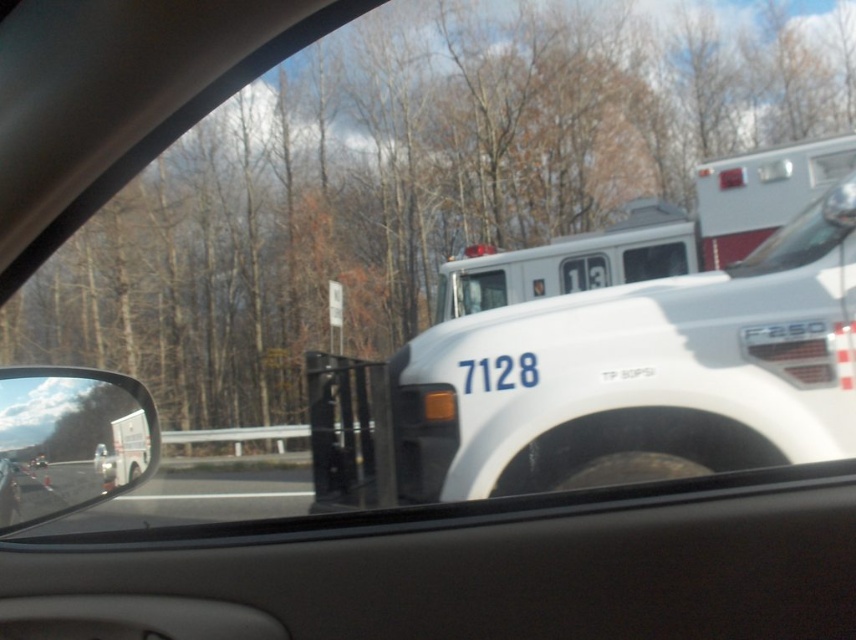
Can you confirm if white glossy fire truck at upper center is shorter than white glossy truck at left?

Yes, white glossy fire truck at upper center is shorter than white glossy truck at left.

Is white glossy fire truck at upper center positioned before white glossy truck at left?

No, it is not.

The image size is (856, 640). I want to click on white glossy fire truck at upper center, so click(655, 230).

Is white glossy fire truck at upper center bigger than clear glass windshield at upper right?

Incorrect, white glossy fire truck at upper center is not larger than clear glass windshield at upper right.

The image size is (856, 640). What are the coordinates of `white glossy fire truck at upper center` in the screenshot? It's located at point(655,230).

How much distance is there between white glossy truck at left and clear glass windshield at upper right?

They are 36.55 feet apart.

Is white glossy truck at left wider than clear glass windshield at upper right?

Correct, the width of white glossy truck at left exceeds that of clear glass windshield at upper right.

Which is in front, point (94, 410) or point (825, 232)?

Point (94, 410) is more forward.

Locate an element on the screen. The image size is (856, 640). white glossy truck at left is located at coordinates (70, 440).